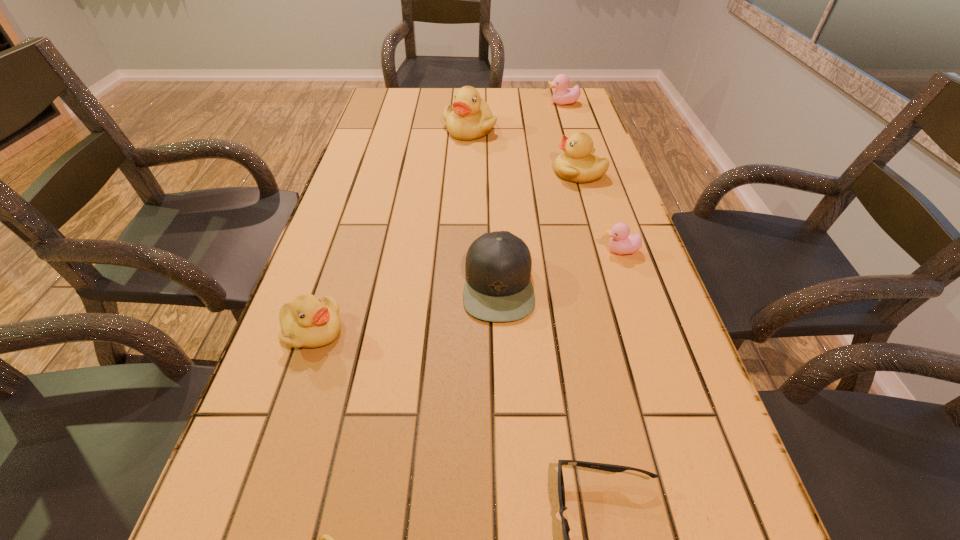
Select which yellow duckling is the fourth closest to the farthest object. Please provide its 2D coordinates. Your answer should be formatted as a tuple, i.e. [(x, y)], where the tuple contains the x and y coordinates of a point satisfying the conditions above.

[(325, 539)]